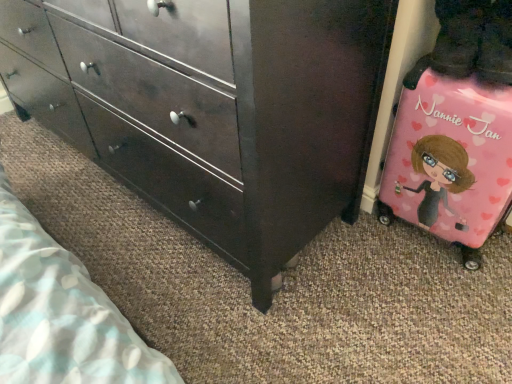
Question: From the image's perspective, is matte dark wood chest of drawers at center above or below pink glossy suitcase at lower right?

Choices:
 (A) below
 (B) above

Answer: (B)

Question: From a real-world perspective, is matte dark wood chest of drawers at center positioned above or below pink glossy suitcase at lower right?

Choices:
 (A) below
 (B) above

Answer: (B)

Question: Is matte dark wood chest of drawers at center situated inside pink glossy suitcase at lower right or outside?

Choices:
 (A) outside
 (B) inside

Answer: (A)

Question: Is pink glossy suitcase at lower right taller or shorter than matte dark wood chest of drawers at center?

Choices:
 (A) short
 (B) tall

Answer: (A)

Question: Based on their positions, is pink glossy suitcase at lower right located to the left or right of matte dark wood chest of drawers at center?

Choices:
 (A) left
 (B) right

Answer: (B)

Question: Considering their positions, is pink glossy suitcase at lower right located in front of or behind matte dark wood chest of drawers at center?

Choices:
 (A) front
 (B) behind

Answer: (B)

Question: Is pink glossy suitcase at lower right bigger or smaller than matte dark wood chest of drawers at center?

Choices:
 (A) big
 (B) small

Answer: (B)